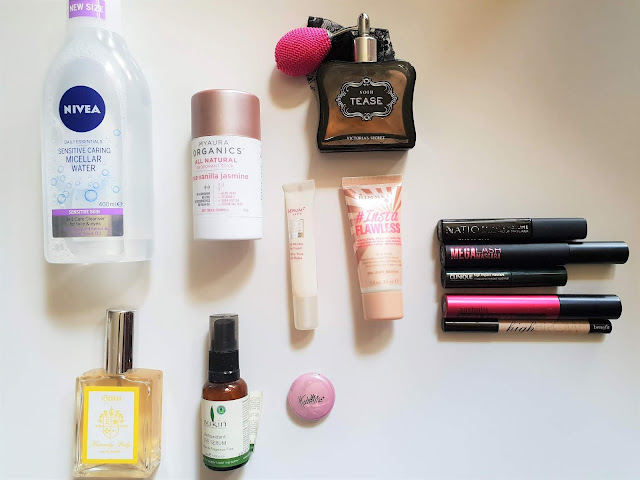
Where is `perfume'`? This screenshot has height=480, width=640. perfume' is located at coordinates (132, 444).